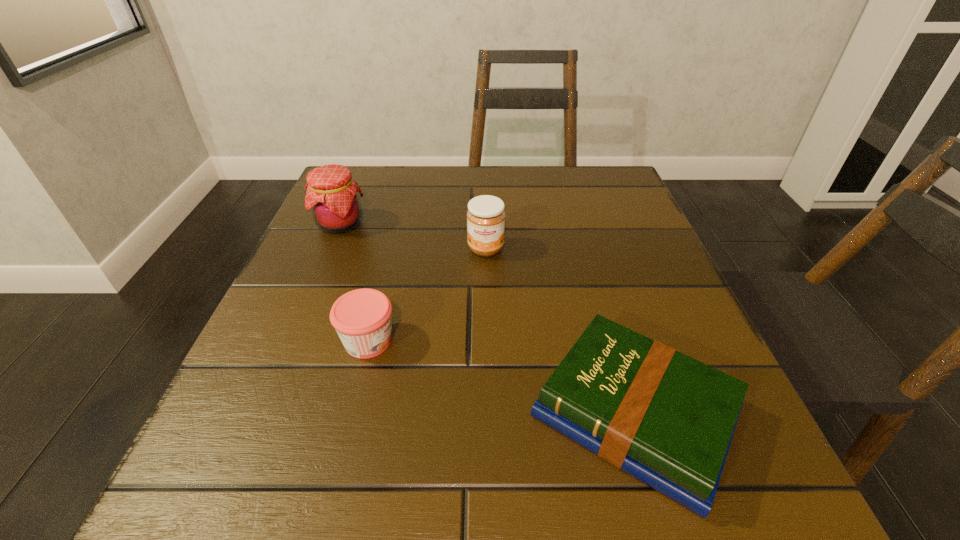
In order to click on the leftmost jam in this screenshot , I will do 332,194.

Image resolution: width=960 pixels, height=540 pixels. Find the location of `the rightmost jam`. the rightmost jam is located at coordinates pyautogui.click(x=485, y=217).

You are a GUI agent. You are given a task and a screenshot of the screen. Output one action in this format:
    pyautogui.click(x=<x>, y=<y>)
    Task: Click on the third tallest object
    
    Given the screenshot: What is the action you would take?
    pyautogui.click(x=362, y=318)

At what (x,y) coordinates should I click in order to perform the action: click on the shortest jam. Please return your answer as a coordinate pair (x, y). Looking at the image, I should click on (362, 318).

Image resolution: width=960 pixels, height=540 pixels. Identify the location of the rightmost object. (667, 419).

The image size is (960, 540). I want to click on book, so pos(667,419).

Find the location of a particular element. The width and height of the screenshot is (960, 540). blank space located 0.120m on the front of the leftmost object is located at coordinates (317, 280).

Find the location of a particular element. Image resolution: width=960 pixels, height=540 pixels. vacant space situated 0.230m on the front label of the third object from left to right is located at coordinates (488, 358).

Locate an element on the screen. Image resolution: width=960 pixels, height=540 pixels. free space located on the front label of the second jam from left to right is located at coordinates (535, 341).

Where is `vacant area located 0.270m on the back of the shortest object`? vacant area located 0.270m on the back of the shortest object is located at coordinates (582, 235).